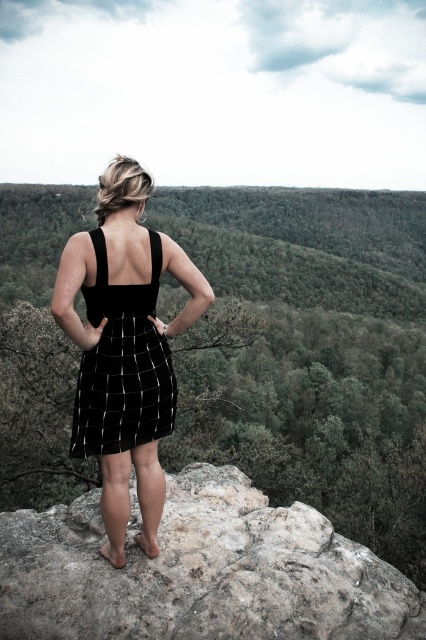
Question: Is gray rough rock at center thinner than black woven dress at center?

Choices:
 (A) no
 (B) yes

Answer: (A)

Question: Which object is the farthest from the gray rough rock at center?

Choices:
 (A) black woven dress at center
 (B) green leafy hillside at upper center

Answer: (B)

Question: Can you confirm if green leafy hillside at upper center is wider than black woven dress at center?

Choices:
 (A) yes
 (B) no

Answer: (A)

Question: Observing the image, what is the correct spatial positioning of black woven dress at center in reference to black velvet dress at center?

Choices:
 (A) left
 (B) right

Answer: (B)

Question: Estimate the real-world distances between objects in this image. Which object is closer to the green leafy hillside at upper center?

Choices:
 (A) black velvet dress at center
 (B) gray rough rock at center

Answer: (B)

Question: Based on their relative distances, which object is farther from the gray rough rock at center?

Choices:
 (A) black woven dress at center
 (B) black velvet dress at center

Answer: (B)